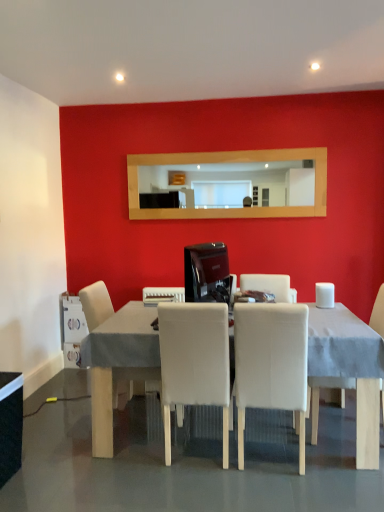
Question: Is the position of white fabric chair at center, arranged as the third chair when viewed from the left, more distant than that of white plastic milk carton at lower left, marked as the 1th appliance in a back-to-front arrangement?

Choices:
 (A) no
 (B) yes

Answer: (A)

Question: Does white fabric chair at center, arranged as the third chair when viewed from the left, have a larger size compared to white plastic milk carton at lower left, marked as the 1th appliance in a back-to-front arrangement?

Choices:
 (A) no
 (B) yes

Answer: (B)

Question: Is white fabric chair at center, arranged as the third chair when viewed from the left, positioned before white plastic milk carton at lower left, which is the third appliance from top to bottom?

Choices:
 (A) yes
 (B) no

Answer: (A)

Question: Is white fabric chair at center, arranged as the third chair when viewed from the left, completely or partially outside of white plastic milk carton at lower left, placed as the third appliance when sorted from front to back?

Choices:
 (A) no
 (B) yes

Answer: (B)

Question: Is white fabric chair at center, the 2th chair from the right, positioned with its back to white plastic milk carton at lower left, the 1th appliance when ordered from bottom to top?

Choices:
 (A) no
 (B) yes

Answer: (A)

Question: Based on their sizes in the image, would you say white plastic toaster at lower center, which is the second appliance in back-to-front order, is bigger or smaller than white fabric chair at center, arranged as the third chair when viewed from the left?

Choices:
 (A) big
 (B) small

Answer: (B)

Question: Considering the positions of point (147, 287) and point (289, 364), is point (147, 287) closer or farther from the camera than point (289, 364)?

Choices:
 (A) closer
 (B) farther

Answer: (B)

Question: Is white plastic toaster at lower center, placed as the 2th appliance when sorted from top to bottom, to the left or to the right of white fabric chair at center, arranged as the third chair when viewed from the left, in the image?

Choices:
 (A) left
 (B) right

Answer: (A)

Question: In terms of width, does white plastic toaster at lower center, which ranks as the 2th appliance in left-to-right order, look wider or thinner when compared to white fabric chair at center, arranged as the third chair when viewed from the left?

Choices:
 (A) thin
 (B) wide

Answer: (A)

Question: Is point (130, 325) positioned closer to the camera than point (226, 465)?

Choices:
 (A) closer
 (B) farther

Answer: (B)

Question: From their relative heights in the image, would you say white fabric table at center, placed as the 2th table when sorted from left to right, is taller or shorter than white leather chair at center, which ranks as the second chair in left-to-right order?

Choices:
 (A) tall
 (B) short

Answer: (B)

Question: From a real-world perspective, relative to white leather chair at center, which ranks as the second chair in left-to-right order, is white fabric table at center, placed as the 2th table when sorted from left to right, vertically above or below?

Choices:
 (A) below
 (B) above

Answer: (A)

Question: From the image's perspective, is white fabric table at center, which is the 1th table from right to left, positioned above or below white leather chair at center, which appears as the 3th chair when viewed from the right?

Choices:
 (A) below
 (B) above

Answer: (A)

Question: Considering their positions, is white fabric chair at center, the 2th chair from the right, located in front of or behind white plastic toaster at lower center, which ranks as the 2th appliance in left-to-right order?

Choices:
 (A) behind
 (B) front

Answer: (B)

Question: Is point (294, 356) closer or farther from the camera than point (158, 290)?

Choices:
 (A) farther
 (B) closer

Answer: (B)